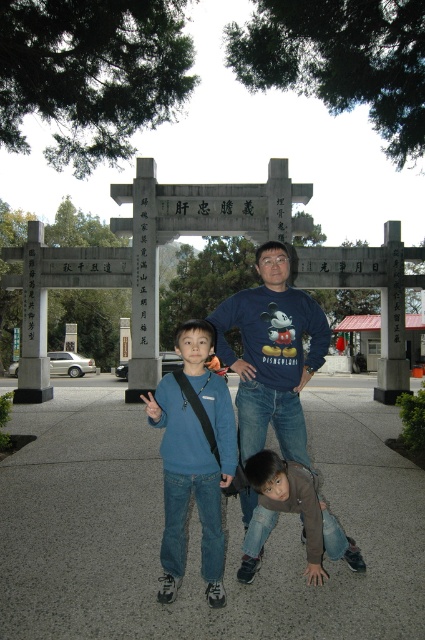
Is matte blue sweater at center shorter than brown denim jeans at lower center?

No.

Can you confirm if matte blue sweater at center is wider than brown denim jeans at lower center?

Incorrect, matte blue sweater at center's width does not surpass brown denim jeans at lower center's.

The width and height of the screenshot is (425, 640). Identify the location of matte blue sweater at center. (193, 461).

Can you confirm if blue cotton shirt at center is thinner than matte blue sweater at center?

In fact, blue cotton shirt at center might be wider than matte blue sweater at center.

Is blue cotton shirt at center in front of matte blue sweater at center?

No, blue cotton shirt at center is behind matte blue sweater at center.

I want to click on blue cotton shirt at center, so click(272, 355).

This screenshot has height=640, width=425. What are the coordinates of `blue cotton shirt at center` in the screenshot? It's located at (272, 355).

Does blue cotton shirt at center have a smaller size compared to brown denim jeans at lower center?

No.

Does blue cotton shirt at center come behind brown denim jeans at lower center?

Yes.

What do you see at coordinates (272, 355) in the screenshot? This screenshot has height=640, width=425. I see `blue cotton shirt at center` at bounding box center [272, 355].

I want to click on blue cotton shirt at center, so click(x=272, y=355).